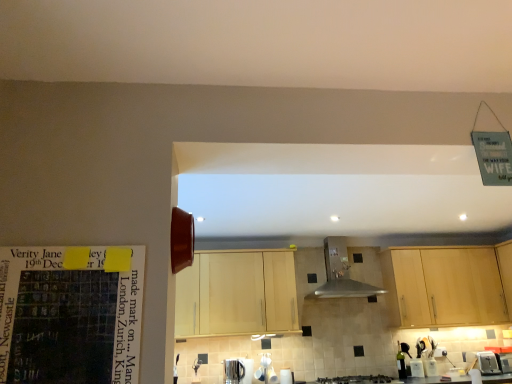
Question: Is satin nickel faucet at lower center closer to the viewer compared to matte paper calendar at left?

Choices:
 (A) yes
 (B) no

Answer: (B)

Question: Considering the relative sizes of satin nickel faucet at lower center and matte paper calendar at left in the image provided, is satin nickel faucet at lower center smaller than matte paper calendar at left?

Choices:
 (A) yes
 (B) no

Answer: (A)

Question: Is satin nickel faucet at lower center not within matte paper calendar at left?

Choices:
 (A) no
 (B) yes

Answer: (B)

Question: From a real-world perspective, is satin nickel faucet at lower center physically above matte paper calendar at left?

Choices:
 (A) yes
 (B) no

Answer: (B)

Question: Does satin nickel faucet at lower center have a greater width compared to matte paper calendar at left?

Choices:
 (A) yes
 (B) no

Answer: (A)

Question: Do you think black matte gas stove at lower center is within satin nickel faucet at lower center, or outside of it?

Choices:
 (A) outside
 (B) inside

Answer: (A)

Question: From a real-world perspective, is black matte gas stove at lower center above or below satin nickel faucet at lower center?

Choices:
 (A) above
 (B) below

Answer: (B)

Question: From the image's perspective, is black matte gas stove at lower center located above or below satin nickel faucet at lower center?

Choices:
 (A) above
 (B) below

Answer: (B)

Question: Is black matte gas stove at lower center bigger or smaller than satin nickel faucet at lower center?

Choices:
 (A) big
 (B) small

Answer: (A)

Question: From a real-world perspective, is black matte gas stove at lower center physically located above or below green glass bottle at lower right?

Choices:
 (A) below
 (B) above

Answer: (A)

Question: From the image's perspective, is black matte gas stove at lower center above or below green glass bottle at lower right?

Choices:
 (A) above
 (B) below

Answer: (B)

Question: In terms of height, does black matte gas stove at lower center look taller or shorter compared to green glass bottle at lower right?

Choices:
 (A) short
 (B) tall

Answer: (A)

Question: Considering the positions of black matte gas stove at lower center and green glass bottle at lower right in the image, is black matte gas stove at lower center bigger or smaller than green glass bottle at lower right?

Choices:
 (A) big
 (B) small

Answer: (A)

Question: In terms of size, does black matte gas stove at lower center appear bigger or smaller than matte paper calendar at left?

Choices:
 (A) big
 (B) small

Answer: (A)

Question: Looking at their shapes, would you say black matte gas stove at lower center is wider or thinner than matte paper calendar at left?

Choices:
 (A) thin
 (B) wide

Answer: (B)